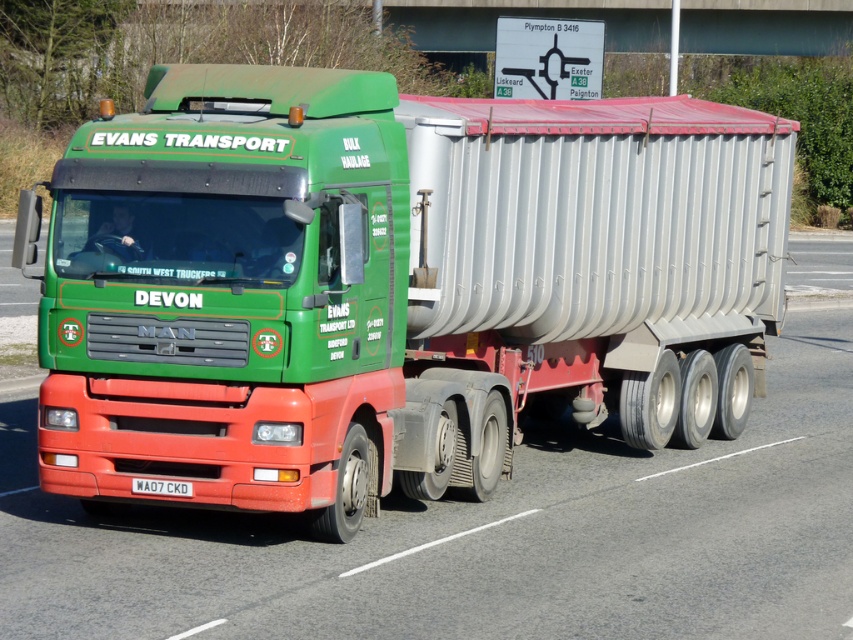
Can you confirm if green matte truck at center is shorter than white plastic license plate at center?

In fact, green matte truck at center may be taller than white plastic license plate at center.

Which is in front, point (177, 116) or point (189, 490)?

Point (189, 490)

Where is `green matte truck at center`? green matte truck at center is located at coordinates (x=393, y=284).